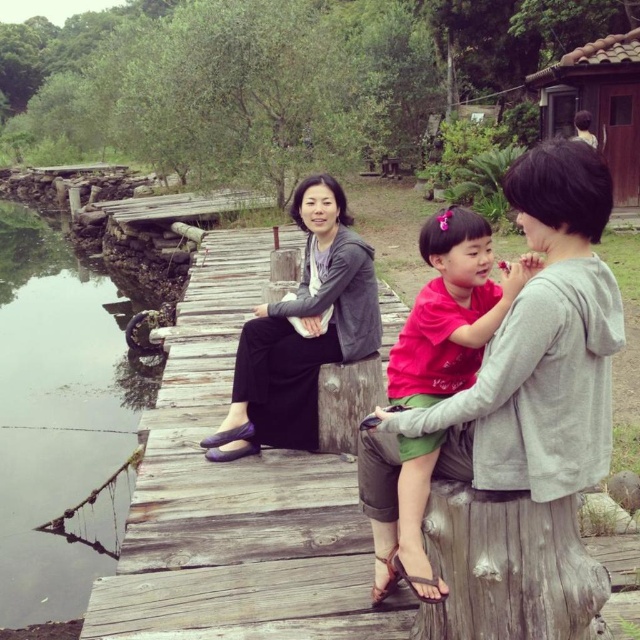
Does matte gray hoodie at center have a greater width compared to matte pink shirt at center?

Yes.

Is point (589, 339) closer to viewer compared to point (440, 308)?

Yes.

Which is in front, point (572, 291) or point (400, 364)?

Point (572, 291) is more forward.

The width and height of the screenshot is (640, 640). Find the location of `matte gray hoodie at center`. matte gray hoodie at center is located at coordinates (522, 364).

Which of these two, transparent water at left or matte gray sweater at center, stands taller?

With more height is transparent water at left.

Does transparent water at left have a greater height compared to matte gray sweater at center?

Yes, transparent water at left is taller than matte gray sweater at center.

Where is `transparent water at left`? transparent water at left is located at coordinates (58, 410).

The height and width of the screenshot is (640, 640). What are the coordinates of `transparent water at left` in the screenshot? It's located at (58, 410).

Does matte gray hoodie at center have a smaller size compared to transparent water at left?

Indeed, matte gray hoodie at center has a smaller size compared to transparent water at left.

Image resolution: width=640 pixels, height=640 pixels. Describe the element at coordinates (522, 364) in the screenshot. I see `matte gray hoodie at center` at that location.

Does point (566, 467) lie in front of point (54, 563)?

Yes, point (566, 467) is in front of point (54, 563).

The height and width of the screenshot is (640, 640). In order to click on matte gray hoodie at center in this screenshot , I will do `click(522, 364)`.